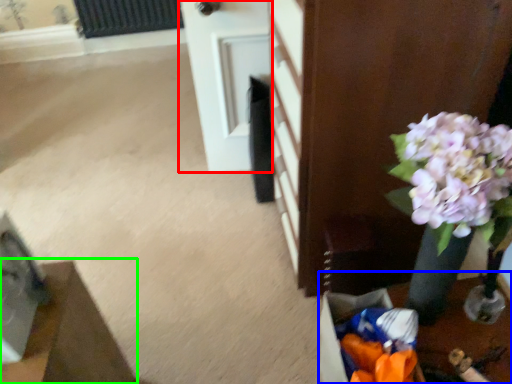
Question: Which object is positioned closest to door (highlighted by a red box)? Select from table (highlighted by a blue box) and furniture (highlighted by a green box).

Choices:
 (A) table
 (B) furniture

Answer: (A)